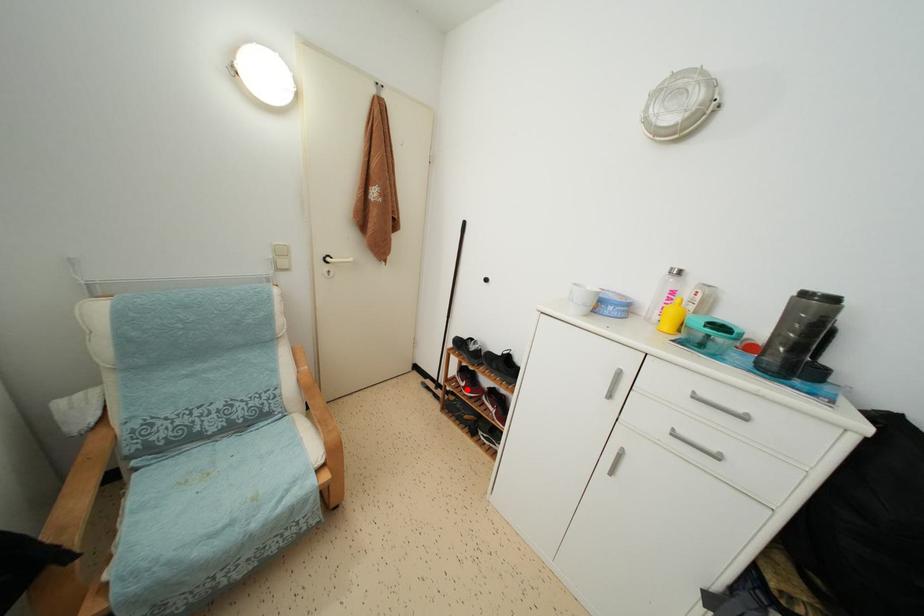
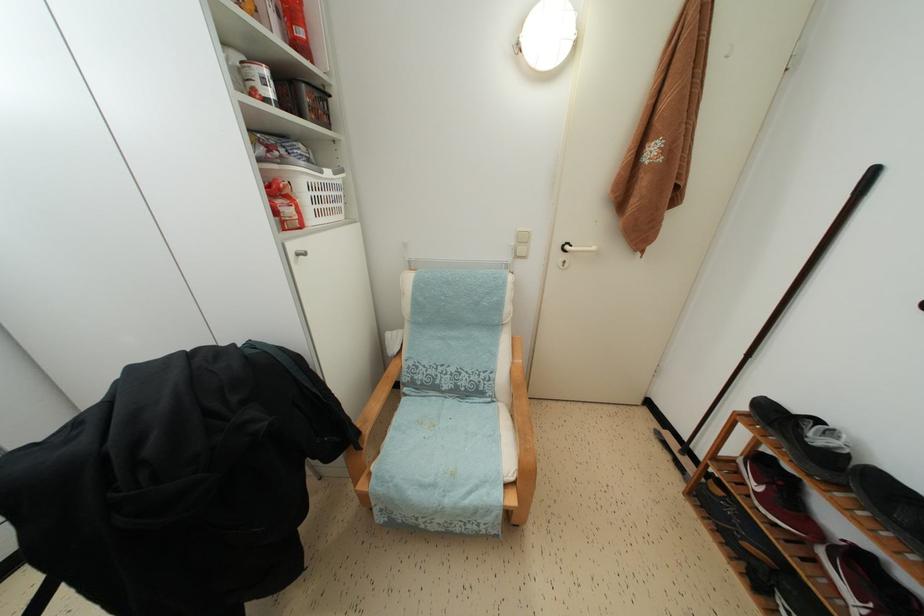
Question: I am providing you with two images of the same scene from different viewpoints. A red point is marked on the first image. At the location where the point appears in image 1, is it still visible in image 2?

Choices:
 (A) Yes
 (B) No

Answer: (A)